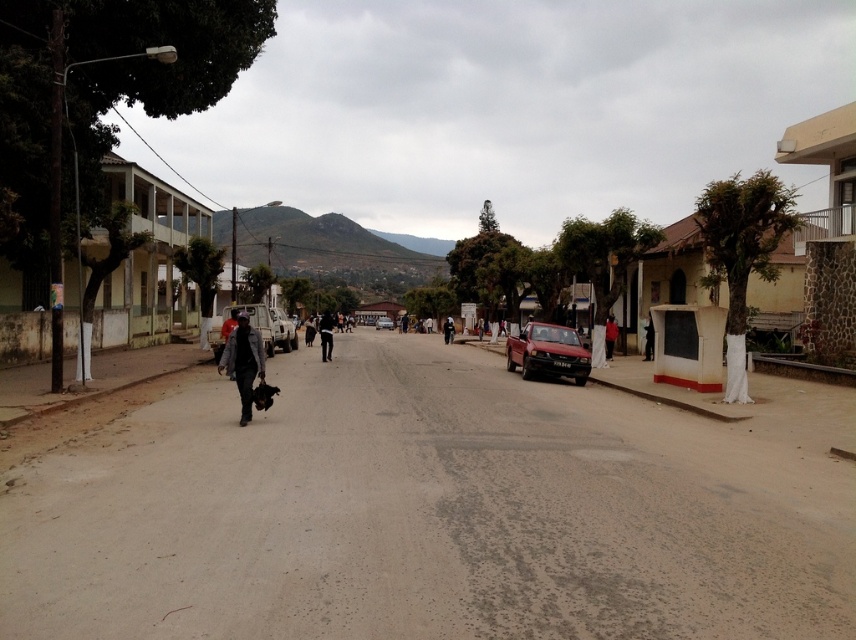
Question: Is dirt track at center positioned before metallic silver truck at center-left?

Choices:
 (A) no
 (B) yes

Answer: (B)

Question: Which point appears closest to the camera in this image?

Choices:
 (A) (272, 316)
 (B) (563, 362)

Answer: (B)

Question: Is black matte pants at center to the right of black matte jacket at center from the viewer's perspective?

Choices:
 (A) no
 (B) yes

Answer: (A)

Question: Which of these objects is positioned farthest from the black matte jacket at center?

Choices:
 (A) shiny red car at center
 (B) dirt track at center

Answer: (B)

Question: Which object appears farthest from the camera in this image?

Choices:
 (A) dirt track at center
 (B) metallic silver truck at center-left

Answer: (B)

Question: Does black matte jacket at center appear on the left side of metallic silver car at center?

Choices:
 (A) no
 (B) yes

Answer: (A)